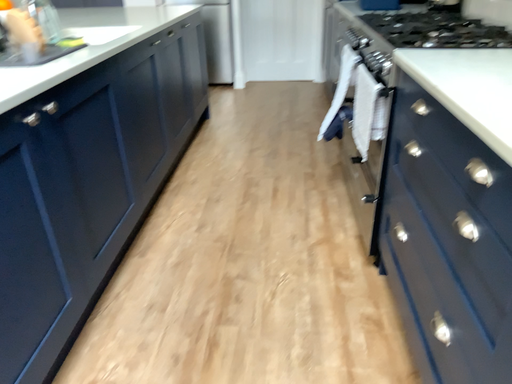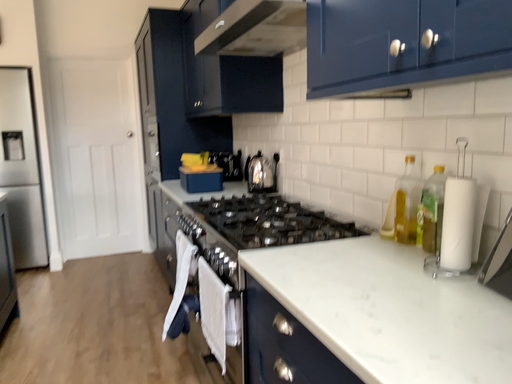
Question: How did the camera likely rotate when shooting the video?

Choices:
 (A) rotated downward
 (B) rotated upward

Answer: (B)